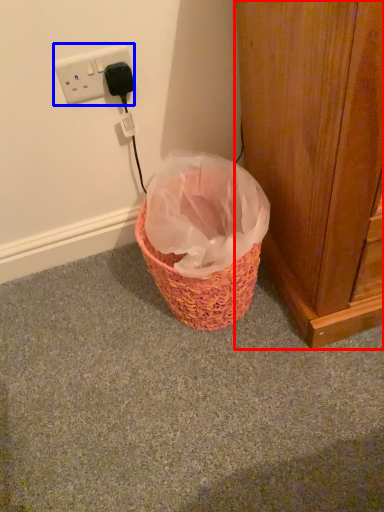
Question: Among these objects, which one is nearest to the camera, door (highlighted by a red box) or power plugs and sockets (highlighted by a blue box)?

Choices:
 (A) door
 (B) power plugs and sockets

Answer: (A)